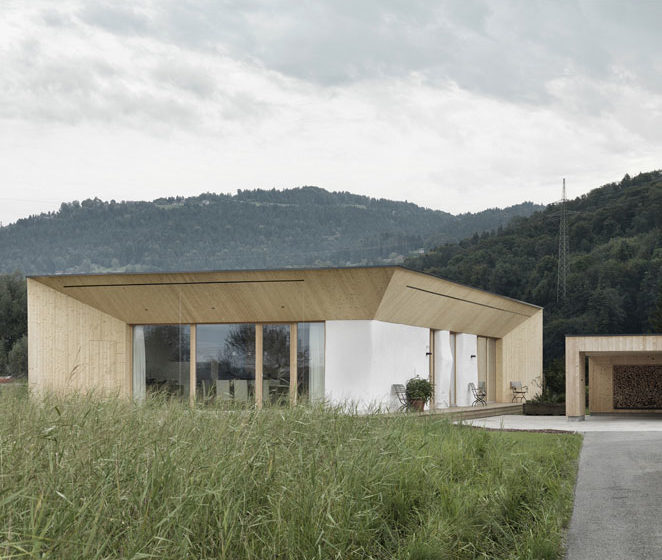
I want to click on freen plants, so click(422, 390).